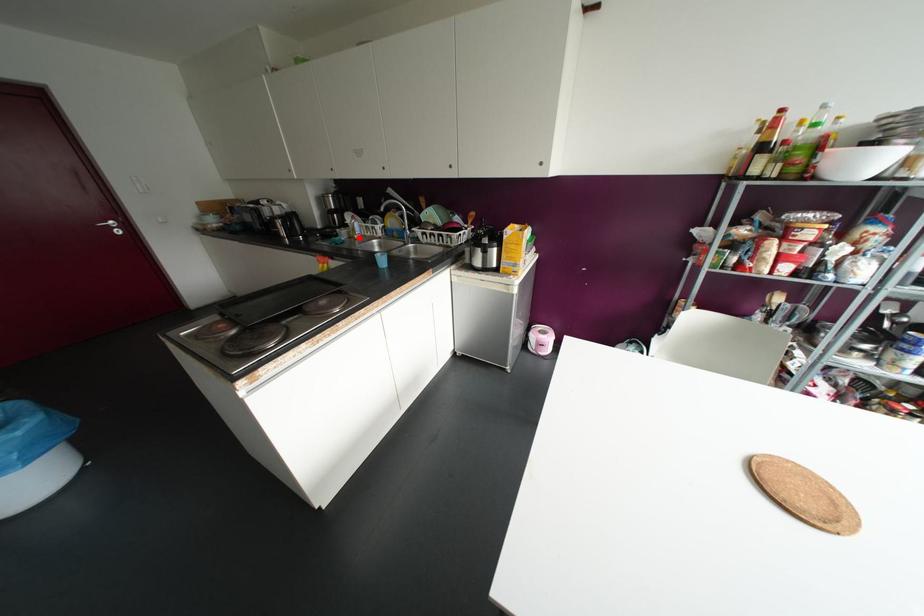
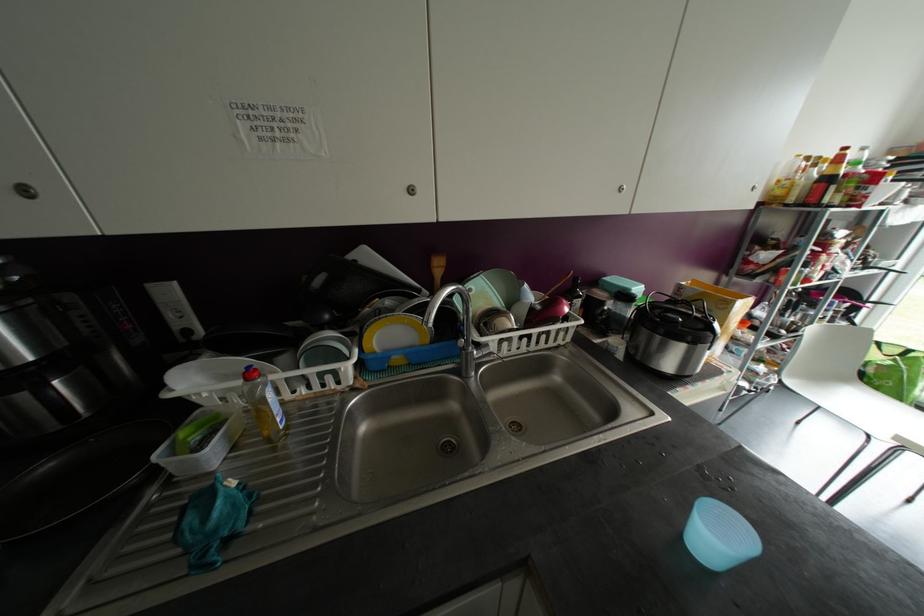
Where in the second image is the point corresponding to the highlighted location from the first image?

(286, 427)